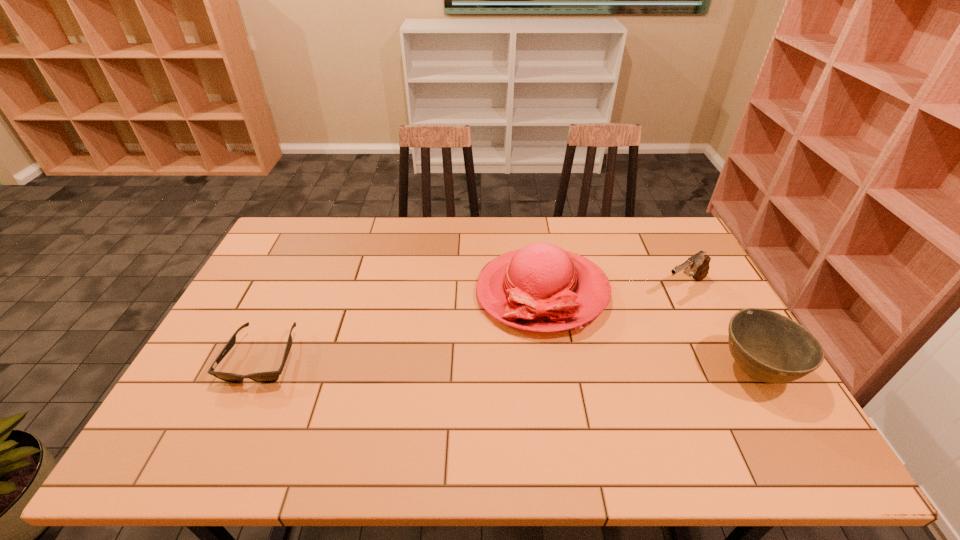
Where is `the shortest object`? This screenshot has height=540, width=960. the shortest object is located at coordinates (263, 377).

This screenshot has height=540, width=960. What are the coordinates of `sunglasses` in the screenshot? It's located at (263, 377).

Locate an element on the screen. bowl is located at coordinates (769, 347).

The width and height of the screenshot is (960, 540). What are the coordinates of `pistol` in the screenshot? It's located at (698, 264).

I want to click on the tallest object, so click(540, 288).

What are the coordinates of `the second object from left to right` in the screenshot? It's located at point(540,288).

This screenshot has height=540, width=960. In order to click on free region located 0.290m on the back of the bowl in this screenshot , I will do `click(699, 273)`.

Identify the location of vacant space located at the barrel of the pistol. Image resolution: width=960 pixels, height=540 pixels. (645, 307).

Identify the location of free space located 0.120m at the barrel of the pistol. (639, 312).

Find the location of `vacant space positioned 0.360m at the barrel of the pistol`. vacant space positioned 0.360m at the barrel of the pistol is located at coordinates (581, 348).